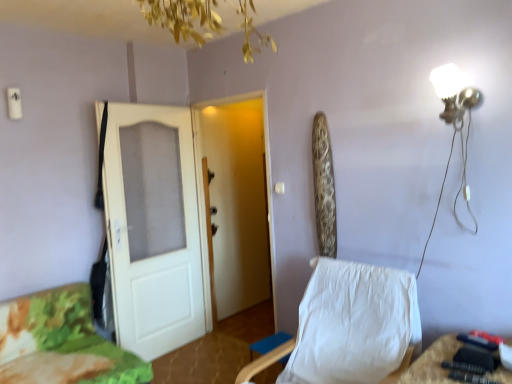
Identify the location of free space between white matte door at left, arranged as the 2th door when viewed from the right, and white wooden door at center, arranged as the 2th door when viewed from the left. The image size is (512, 384). (204, 356).